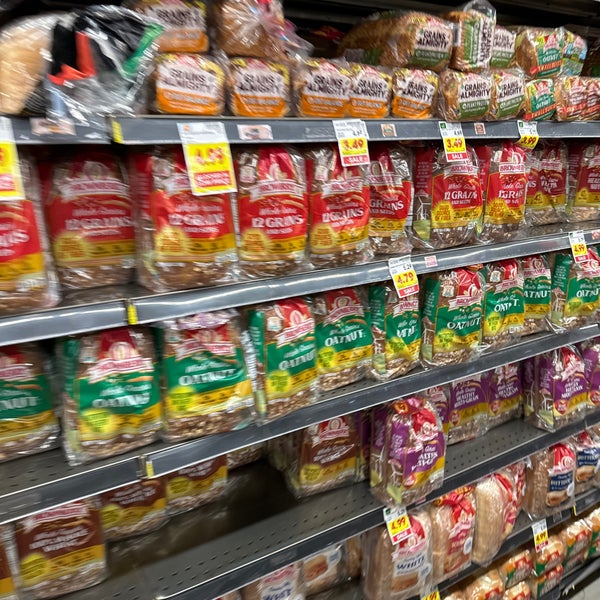
Find the location of `large tags on shelves`. large tags on shelves is located at coordinates pyautogui.click(x=16, y=181), pyautogui.click(x=219, y=165), pyautogui.click(x=358, y=149), pyautogui.click(x=463, y=143), pyautogui.click(x=534, y=141), pyautogui.click(x=578, y=252), pyautogui.click(x=408, y=277), pyautogui.click(x=404, y=526), pyautogui.click(x=539, y=541), pyautogui.click(x=434, y=596).